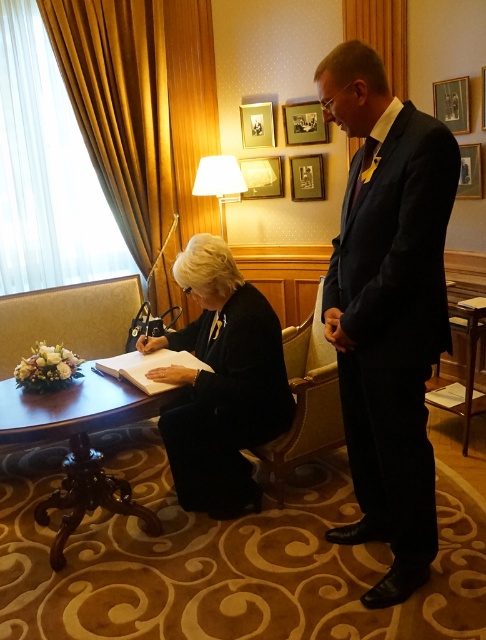
Question: In this image, where is navy blue suit at center located relative to wooden table at lower right?

Choices:
 (A) below
 (B) above

Answer: (B)

Question: Estimate the real-world distances between objects in this image. Which object is farther from the mahogany wood round table at lower left?

Choices:
 (A) black fabric jacket at lower center
 (B) wooden table at lower right
 (C) black suit at center
 (D) navy blue suit at center

Answer: (B)

Question: Does black suit at center have a greater width compared to mahogany wood round table at lower left?

Choices:
 (A) yes
 (B) no

Answer: (B)

Question: Which point is farther to the camera?

Choices:
 (A) (94, 484)
 (B) (438, 388)
 (C) (241, 307)

Answer: (B)

Question: Does black suit at center have a lesser width compared to mahogany wood round table at lower left?

Choices:
 (A) no
 (B) yes

Answer: (B)

Question: Which point is closer to the camera taking this photo?

Choices:
 (A) (410, 308)
 (B) (457, 330)

Answer: (A)